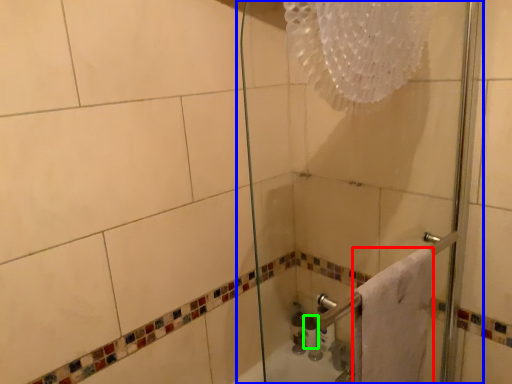
Question: Which object is the closest to the towel (highlighted by a red box)? Choose among these: shower door (highlighted by a blue box) or toiletry (highlighted by a green box).

Choices:
 (A) shower door
 (B) toiletry

Answer: (A)